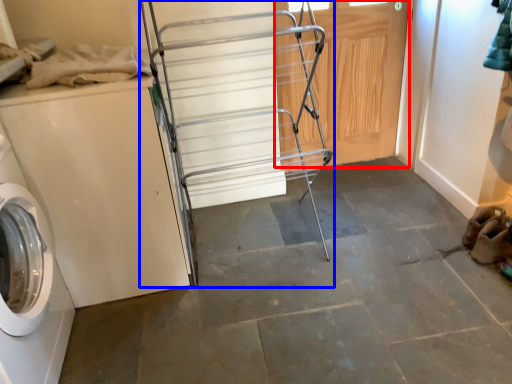
Question: Which of the following is the farthest to the observer, door (highlighted by a red box) or cart (highlighted by a blue box)?

Choices:
 (A) door
 (B) cart

Answer: (A)